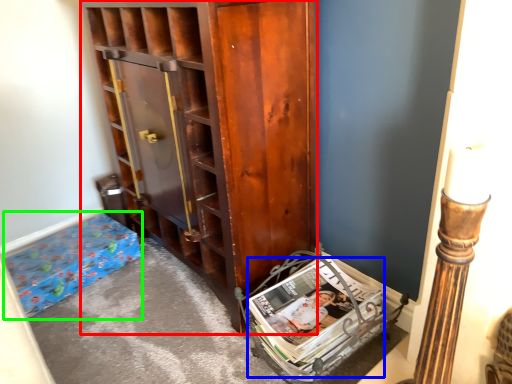
Question: Which object is the closest to the cabinetry (highlighted by a red box)? Choose among these: magazine (highlighted by a blue box) or furniture (highlighted by a green box).

Choices:
 (A) magazine
 (B) furniture

Answer: (A)